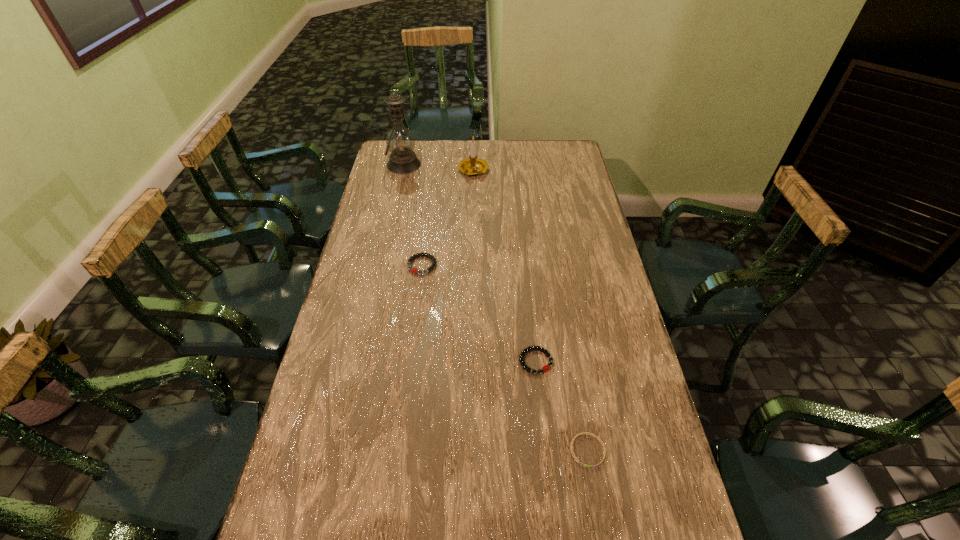
This screenshot has width=960, height=540. I want to click on vacant area located on the right of the leftmost object, so click(492, 165).

The image size is (960, 540). What are the coordinates of `vacant space located 0.190m on the front of the fourth shortest object` in the screenshot? It's located at (472, 208).

I want to click on free space located 0.190m on the left of the third nearest object, so click(x=353, y=265).

You are a GUI agent. You are given a task and a screenshot of the screen. Output one action in this format:
    pyautogui.click(x=<x>, y=<y>)
    Task: Click on the vacant area situated 0.200m on the front of the second farthest bracelet
    This screenshot has width=960, height=540.
    Given the screenshot: What is the action you would take?
    pyautogui.click(x=544, y=446)

Locate an element on the screen. This screenshot has width=960, height=540. vacant space located on the surface of the rightmost bracelet showing star-shaped elements is located at coordinates (597, 508).

The height and width of the screenshot is (540, 960). Identify the location of oil lamp located at the far edge. pyautogui.click(x=400, y=141).

I want to click on candle holder that is at the far edge, so click(x=472, y=166).

Identify the location of object present at the left edge. (400, 141).

Where is `object present at the right edge`? object present at the right edge is located at coordinates (583, 433).

Locate an element on the screen. This screenshot has width=960, height=540. object that is at the far left corner is located at coordinates (400, 141).